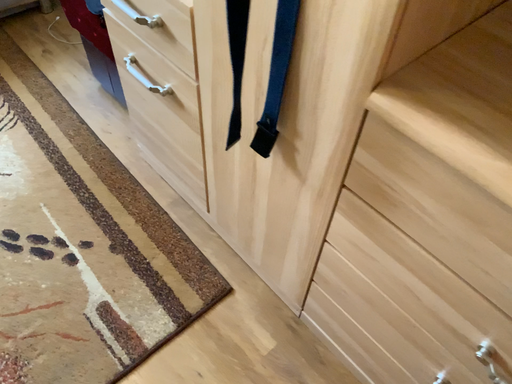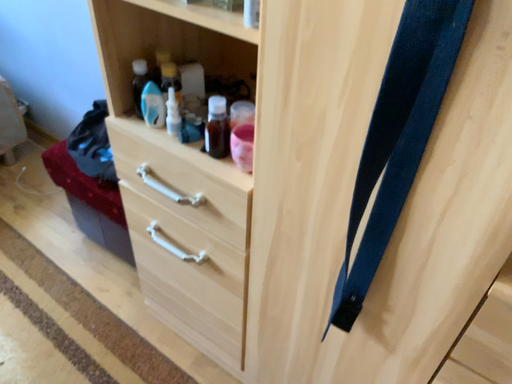
Question: Which way did the camera rotate in the video?

Choices:
 (A) rotated left
 (B) rotated right

Answer: (B)